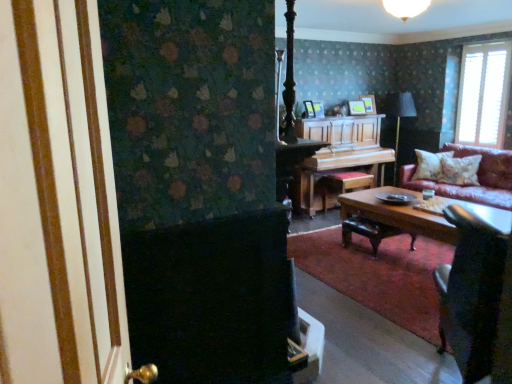
Question: Is velvet dark brown armchair at lower right at the back of fluffy white pillow at right, which appears as the 2th pillow when viewed from the back?

Choices:
 (A) no
 (B) yes

Answer: (A)

Question: Is fluffy white pillow at right, which appears as the 2th pillow when viewed from the back, far away from velvet dark brown armchair at lower right?

Choices:
 (A) no
 (B) yes

Answer: (B)

Question: Does fluffy white pillow at right, the 1th pillow positioned from the front, have a larger size compared to velvet dark brown armchair at lower right?

Choices:
 (A) yes
 (B) no

Answer: (B)

Question: From a real-world perspective, is fluffy white pillow at right, which appears as the 2th pillow when viewed from the back, physically below velvet dark brown armchair at lower right?

Choices:
 (A) yes
 (B) no

Answer: (B)

Question: Does fluffy white pillow at right, the 1th pillow positioned from the front, appear on the left side of velvet dark brown armchair at lower right?

Choices:
 (A) yes
 (B) no

Answer: (B)

Question: Can you confirm if fluffy white pillow at right, which appears as the 2th pillow when viewed from the back, is shorter than velvet dark brown armchair at lower right?

Choices:
 (A) yes
 (B) no

Answer: (A)

Question: Is white textured blinds at upper right smaller than white textured pillow at right, the first pillow in the back-to-front sequence?

Choices:
 (A) no
 (B) yes

Answer: (A)

Question: Is white textured blinds at upper right at the left side of white textured pillow at right, marked as the second pillow in a front-to-back arrangement?

Choices:
 (A) no
 (B) yes

Answer: (A)

Question: Is white textured blinds at upper right next to white textured pillow at right, marked as the second pillow in a front-to-back arrangement, and touching it?

Choices:
 (A) yes
 (B) no

Answer: (B)

Question: Is white textured blinds at upper right positioned with its back to white textured pillow at right, marked as the second pillow in a front-to-back arrangement?

Choices:
 (A) no
 (B) yes

Answer: (A)

Question: Considering the relative sizes of white textured blinds at upper right and white textured pillow at right, marked as the second pillow in a front-to-back arrangement, in the image provided, is white textured blinds at upper right shorter than white textured pillow at right, marked as the second pillow in a front-to-back arrangement,?

Choices:
 (A) yes
 (B) no

Answer: (B)

Question: Is white textured blinds at upper right aimed at white textured pillow at right, marked as the second pillow in a front-to-back arrangement?

Choices:
 (A) yes
 (B) no

Answer: (A)

Question: Is white textured pillow at right, marked as the second pillow in a front-to-back arrangement, not close to wooden polished coffee table at center?

Choices:
 (A) yes
 (B) no

Answer: (A)